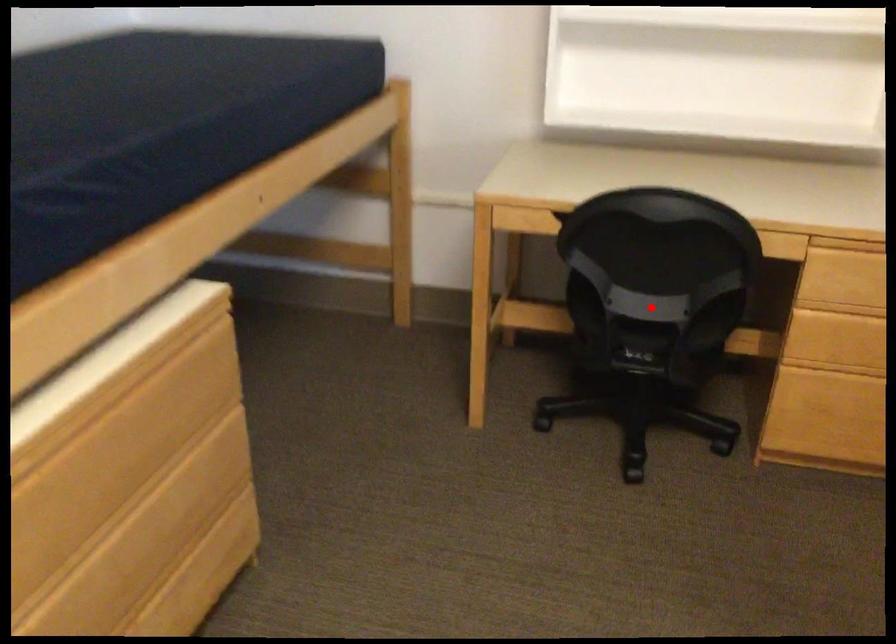
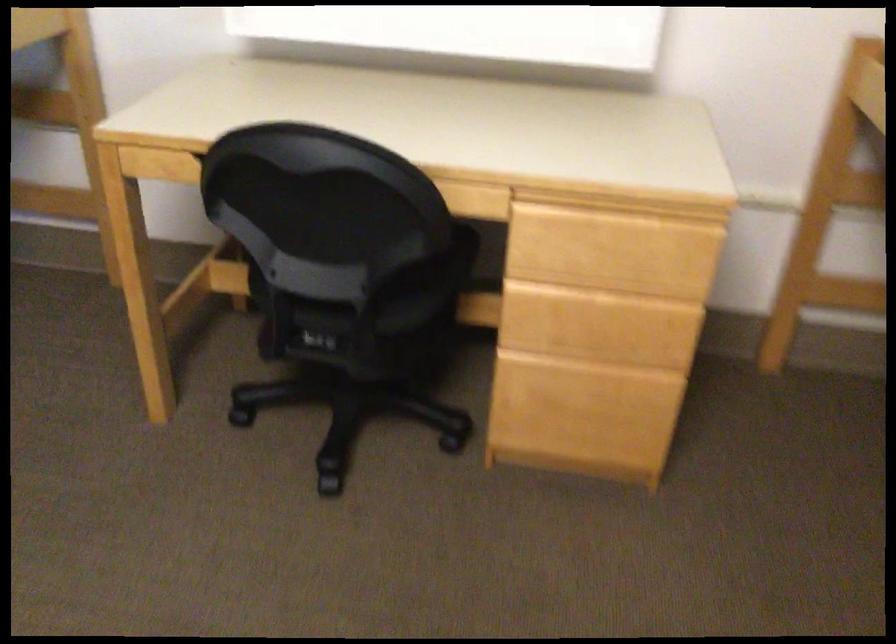
The point at the highlighted location is marked in the first image. Where is the corresponding point in the second image?

(322, 279)